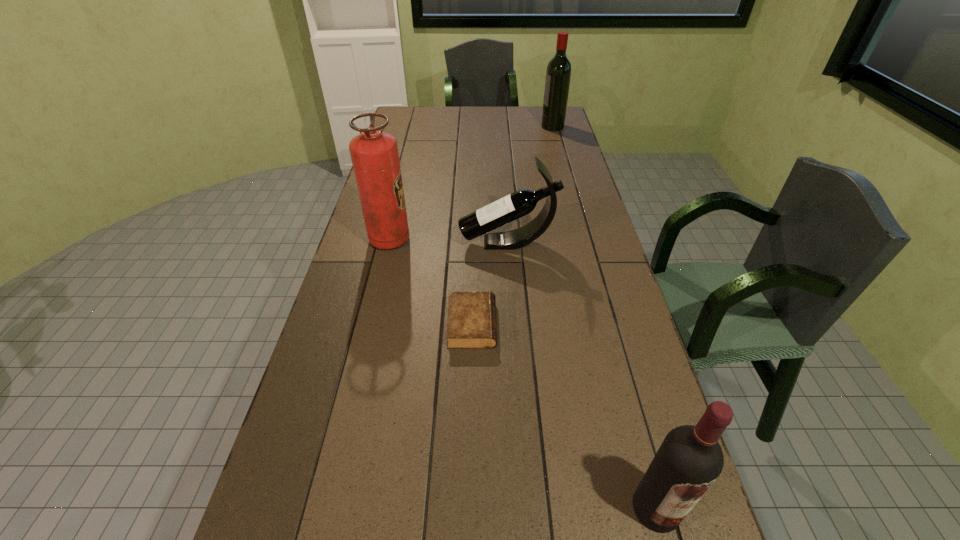
You are a GUI agent. You are given a task and a screenshot of the screen. Output one action in this format:
    pyautogui.click(x=<x>, y=<y>)
    Task: Click on the fire extinguisher
    
    Given the screenshot: What is the action you would take?
    pyautogui.click(x=374, y=154)

At what (x,y) coordinates should I click in order to perform the action: click on the farthest object. Please return your answer as a coordinate pair (x, y). Looking at the image, I should click on (558, 74).

You are a GUI agent. You are given a task and a screenshot of the screen. Output one action in this format:
    pyautogui.click(x=<x>, y=<y>)
    Task: Click on the nearest object
    This screenshot has height=540, width=960.
    Given the screenshot: What is the action you would take?
    point(689,460)

What are the coordinates of `the leftmost wine bottle` in the screenshot? It's located at (522, 202).

Find the location of a particular element. This screenshot has width=960, height=540. the second nearest wine bottle is located at coordinates (522, 202).

Identify the location of the second nearest object. (471, 320).

At what (x,y) coordinates should I click in order to perform the action: click on the shortest object. Please return your answer as a coordinate pair (x, y). The height and width of the screenshot is (540, 960). Looking at the image, I should click on (471, 320).

Locate an element on the screen. This screenshot has width=960, height=540. free spot located on the label side of the fire extinguisher is located at coordinates (467, 240).

Image resolution: width=960 pixels, height=540 pixels. I want to click on vacant space located 0.210m on the label of the farthest wine bottle, so 497,126.

This screenshot has width=960, height=540. Find the location of `free space located on the label of the farthest wine bottle`. free space located on the label of the farthest wine bottle is located at coordinates click(x=470, y=126).